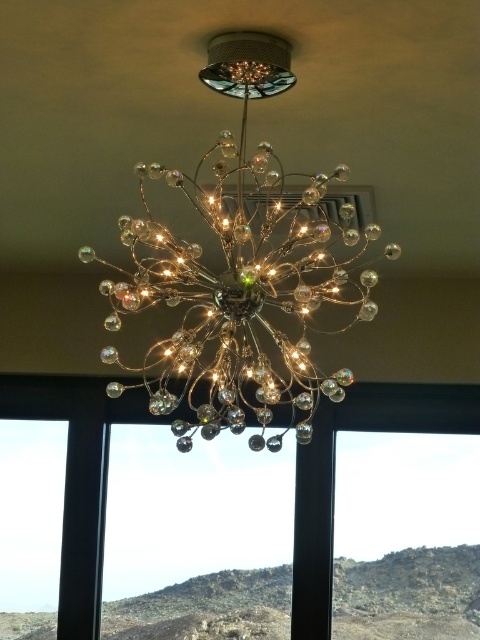
Question: Does metallic crystal chandelier at center have a lesser width compared to transparent glass window at center?

Choices:
 (A) no
 (B) yes

Answer: (A)

Question: Among these points, which one is farthest from the camera?

Choices:
 (A) (189, 291)
 (B) (71, 636)

Answer: (B)

Question: Can you confirm if metallic crystal chandelier at center is positioned above transparent glass window at center?

Choices:
 (A) no
 (B) yes

Answer: (B)

Question: Is metallic crystal chandelier at center below transparent glass window at center?

Choices:
 (A) no
 (B) yes

Answer: (A)

Question: Which point appears farthest from the camera in this image?

Choices:
 (A) pos(308,458)
 (B) pos(292,212)

Answer: (A)